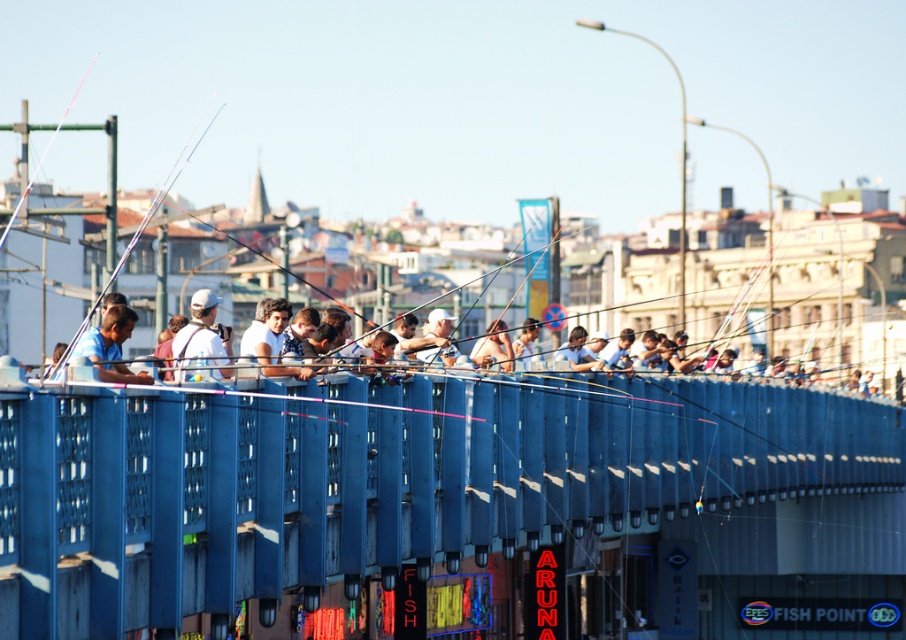
In the scene shown: You are a photographer trying to capture a clear shot of the white matte cap at center and the blue matte shirt at center from above the bridge. Since you want to focus on the cap and shirt, which object should you position closer to the camera to ensure it stands out more?

The white matte cap at center is taller than the blue matte shirt at center, so positioning the white matte cap at center closer to the camera would make it appear larger and more prominent in the photo.

You are a painter standing on the bridge and want to paint the blue metal fence at center and the metallic fishing pole at left. Which object will require more horizontal space on your canvas if you want to paint them to scale?

The metallic fishing pole at left requires more horizontal space on the canvas because it is wider than the blue metal fence at center.

You are standing on the bridge and want to see the person wearing the blue matte shirt at center. Since there are many people fishing, which direction should you look relative to the white matte cap at center?

The blue matte shirt at center is behind the white matte cap at center, so you should look behind the white matte cap at center to see the blue matte shirt at center.